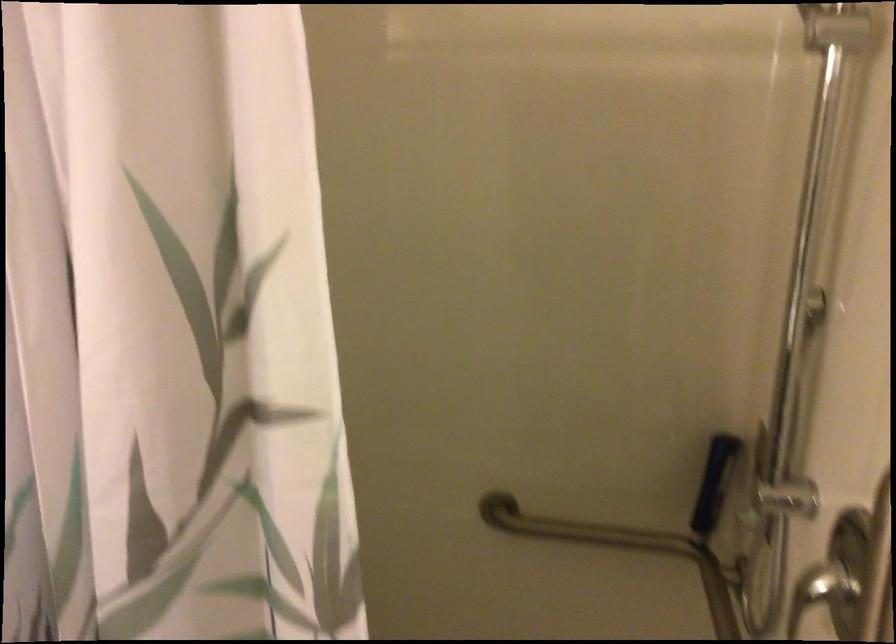
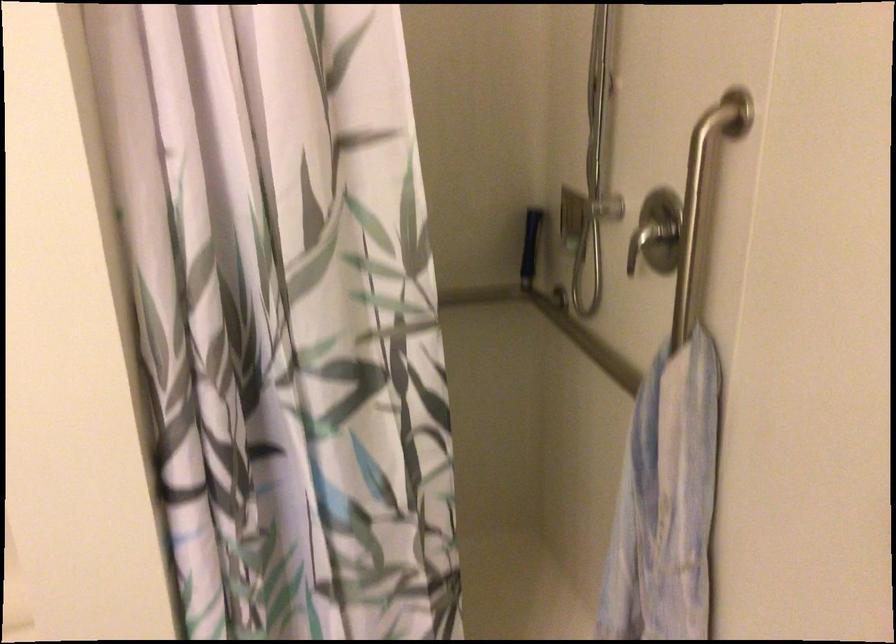
In a continuous first-person perspective shot, in which direction is the camera moving?

The movement direction of the cameraman is left, backward.